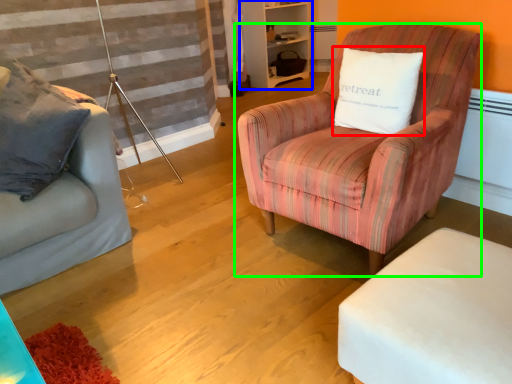
Question: Estimate the real-world distances between objects in this image. Which object is farther from pillow (highlighted by a red box), bookshelf (highlighted by a blue box) or chair (highlighted by a green box)?

Choices:
 (A) bookshelf
 (B) chair

Answer: (A)